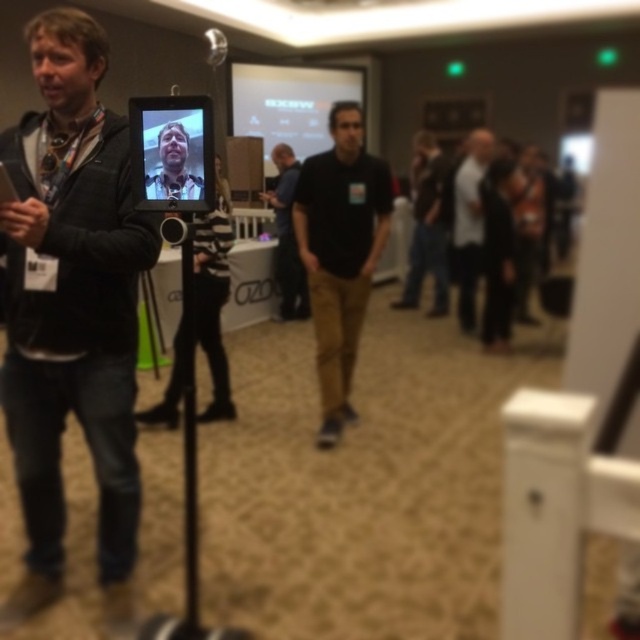
Between black plastic tripod at center and white matte shirt at center, which one appears on the right side from the viewer's perspective?

From the viewer's perspective, white matte shirt at center appears more on the right side.

Can you confirm if black plastic tripod at center is wider than white matte shirt at center?

No.

The height and width of the screenshot is (640, 640). What are the coordinates of `black plastic tripod at center` in the screenshot? It's located at (188, 464).

Find the location of a particular element. This screenshot has width=640, height=640. black plastic tripod at center is located at coordinates (188, 464).

Who is lower down, matte black tablet at center or dark gray shirt at center?

matte black tablet at center is below.

Does matte black tablet at center have a smaller size compared to dark gray shirt at center?

Indeed, matte black tablet at center has a smaller size compared to dark gray shirt at center.

At what (x,y) coordinates should I click in order to perform the action: click on matte black tablet at center. Please return your answer as a coordinate pair (x, y). This screenshot has height=640, width=640. Looking at the image, I should click on (172, 152).

What do you see at coordinates (339, 252) in the screenshot? I see `black matte shirt at center` at bounding box center [339, 252].

Can you confirm if black matte shirt at center is positioned above black plastic tripod at center?

Indeed, black matte shirt at center is positioned over black plastic tripod at center.

Is point (352, 140) behind point (196, 582)?

Yes, point (352, 140) is behind point (196, 582).

The height and width of the screenshot is (640, 640). In order to click on black matte shirt at center in this screenshot , I will do `click(339, 252)`.